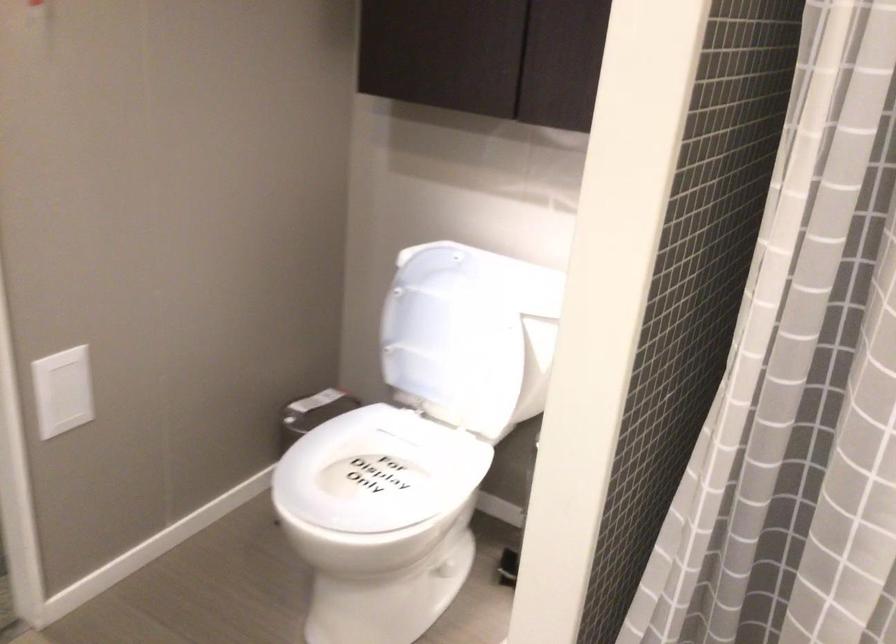
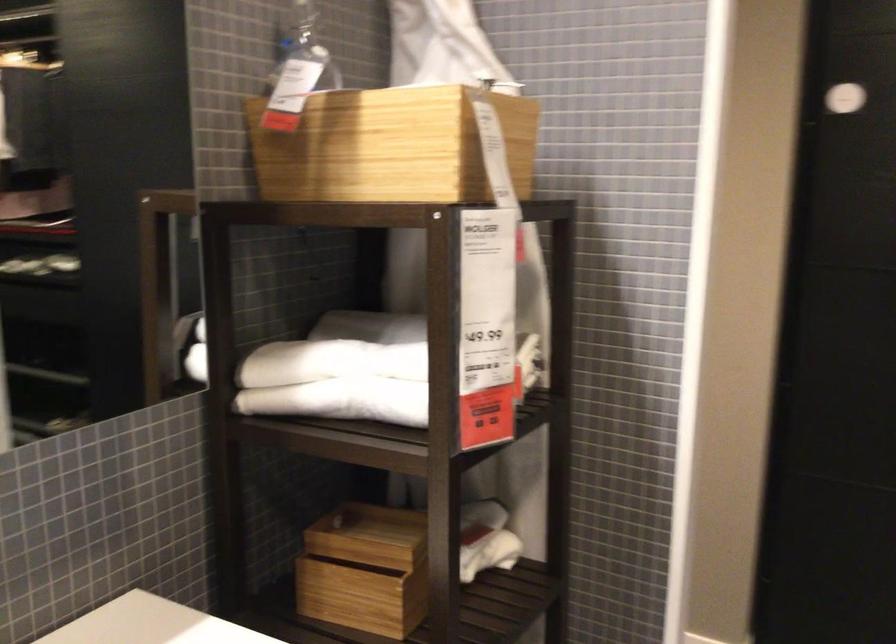
Question: The camera is either moving clockwise (left) or counter-clockwise (right) around the object. The first image is from the beginning of the video and the second image is from the end. Is the camera moving left or right when shooting the video?

Choices:
 (A) Left
 (B) Right

Answer: (B)